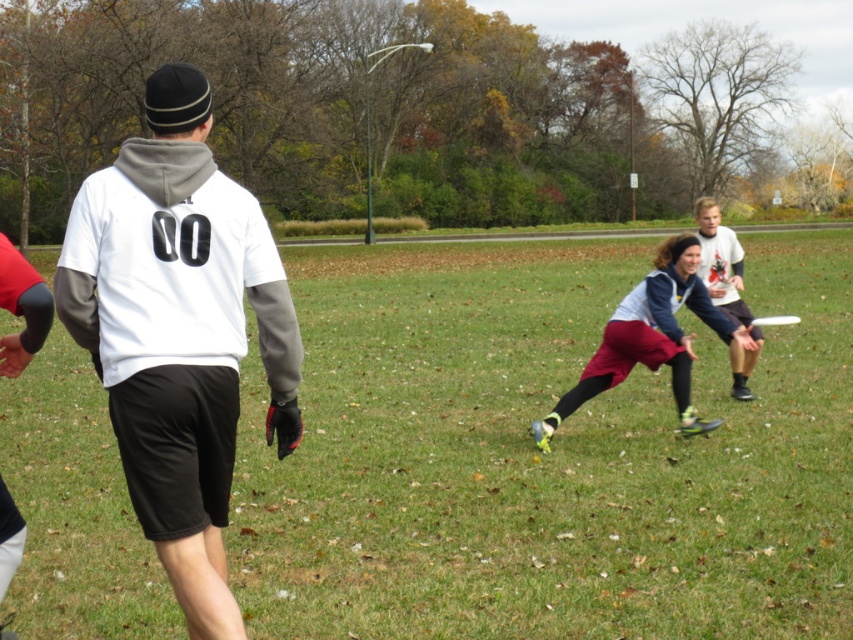
Consider the image. You are a player in an ultimate frisbee game and you see the maroon fabric pants at center and the white plastic frisbee at center. Which object is bigger in size?

The maroon fabric pants at center is larger in size compared to the white plastic frisbee at center.

In the scene shown: You are a player in an ultimate frisbee game on the green grass at center and wearing the white jersey at center. You want to sprint towards the end zone 20 meters away. Considering the ground you are standing on, will your sprint be faster or slower compared to running on a harder surface like concrete?

The green grass at center has a larger width than the white jersey at center, but this does not directly affect your sprint speed. Sprinting on grass typically offers more traction and cushioning compared to concrete, so your sprint would likely be faster on the green grass at center than on a hard surface like concrete.

You are a player in the ultimate frisbee game and need to pass the frisbee to your teammate. The teammate is wearing a white matte hoodie at center. Based on their position, can you throw the frisbee directly to them without it going over any other players?

The white matte hoodie at center is located at point (178, 332), so yes, you can throw the frisbee directly to them as there are no other players mentioned in the Objects list blocking the path.